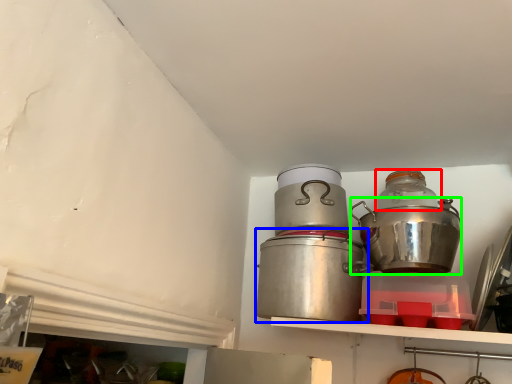
Question: Based on their relative distances, which object is nearer to bottle (highlighted by a red box)? Choose from crock pot (highlighted by a blue box) and crock pot (highlighted by a green box).

Choices:
 (A) crock pot
 (B) crock pot

Answer: (B)